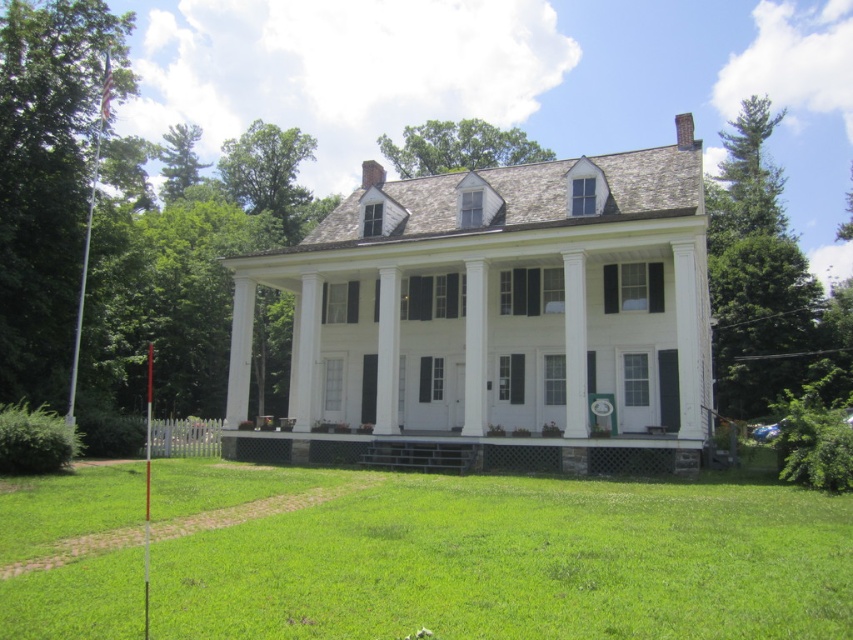
Question: Does white painted wood house at center appear over green grass at center?

Choices:
 (A) no
 (B) yes

Answer: (B)

Question: Does white painted wood house at center appear on the left side of green grass at center?

Choices:
 (A) no
 (B) yes

Answer: (A)

Question: Which of these objects is positioned farthest from the white painted wood house at center?

Choices:
 (A) green grass at center
 (B) stone porch at center

Answer: (A)

Question: Which object is the farthest from the stone porch at center?

Choices:
 (A) white painted wood house at center
 (B) green grass at center

Answer: (B)

Question: In this image, where is white painted wood house at center located relative to green grass at center?

Choices:
 (A) left
 (B) right

Answer: (B)

Question: Which point appears closest to the camera in this image?

Choices:
 (A) (790, 545)
 (B) (633, 458)

Answer: (A)